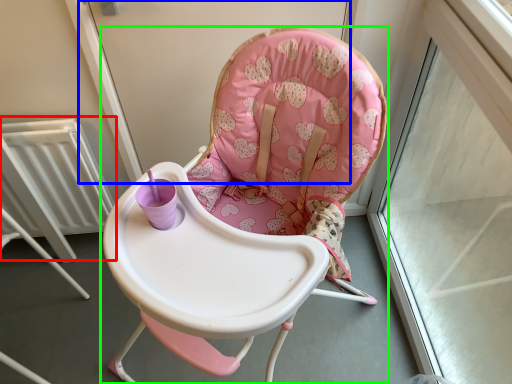
Question: Which object is positioned closest to radiator (highlighted by a red box)? Select from screen door (highlighted by a blue box) and chair (highlighted by a green box).

Choices:
 (A) screen door
 (B) chair

Answer: (A)